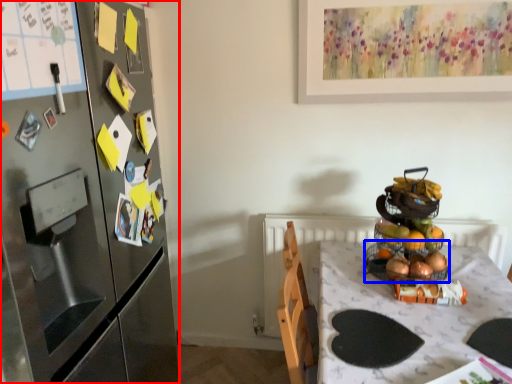
Question: Which object appears farthest to the camera in this image, cabinetry (highlighted by a red box) or basket (highlighted by a blue box)?

Choices:
 (A) cabinetry
 (B) basket

Answer: (B)